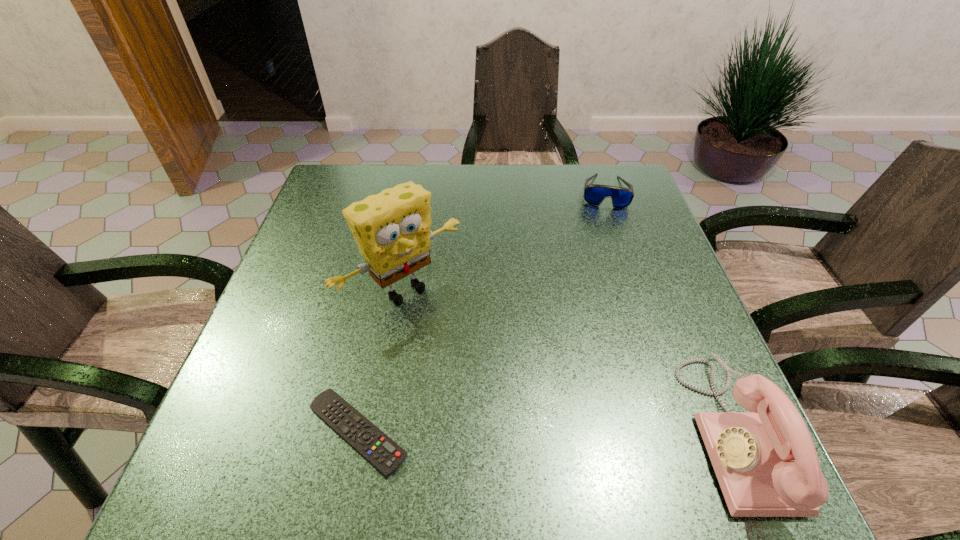
At what (x,y) coordinates should I click in order to perform the action: click on vacant space on the desktop that is between the shortest object and the second tallest object and is positioned on the face of the second farthest object. Please return your answer as a coordinate pair (x, y). The width and height of the screenshot is (960, 540). Looking at the image, I should click on (541, 432).

This screenshot has width=960, height=540. I want to click on free spot on the desktop that is between the remote control and the second tallest object and is positioned on the front-facing side of the farthest object, so click(591, 432).